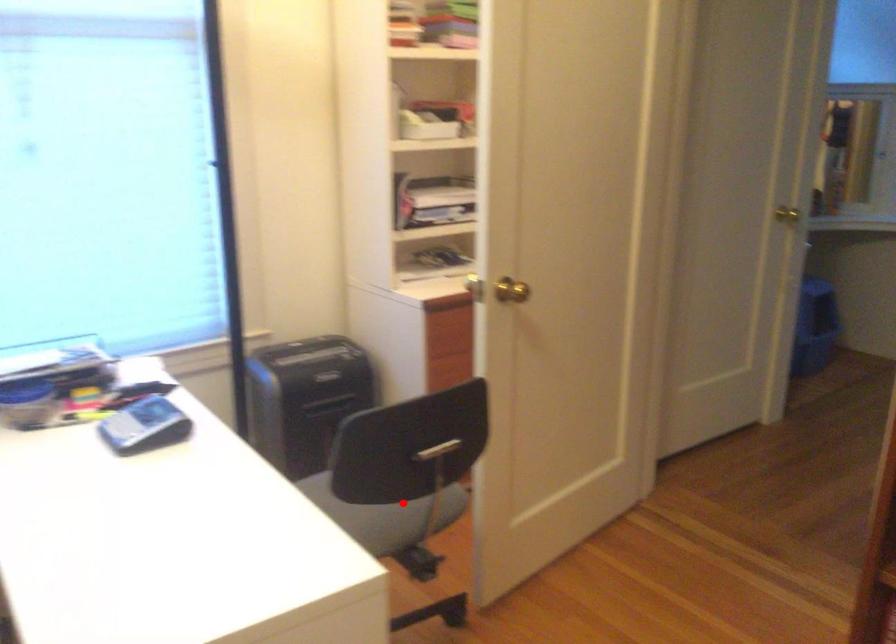
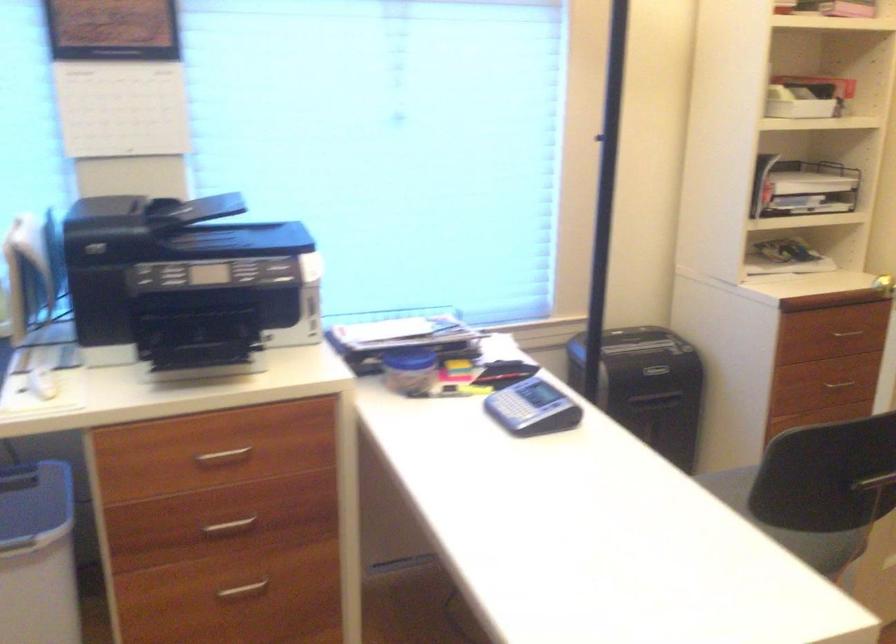
Question: A red point is marked in image1. In image2, is the corresponding 3D point closer to the camera or farther? Reply with the corresponding letter.

Choices:
 (A) The corresponding 3D point is closer.
 (B) The corresponding 3D point is farther.

Answer: (A)